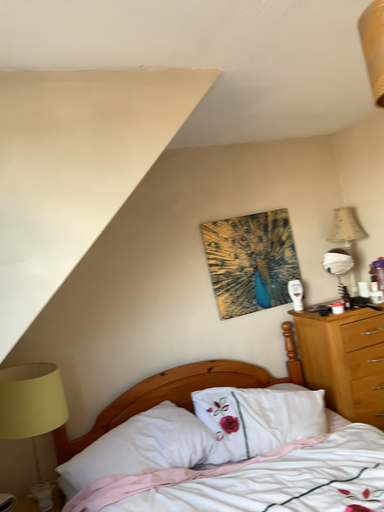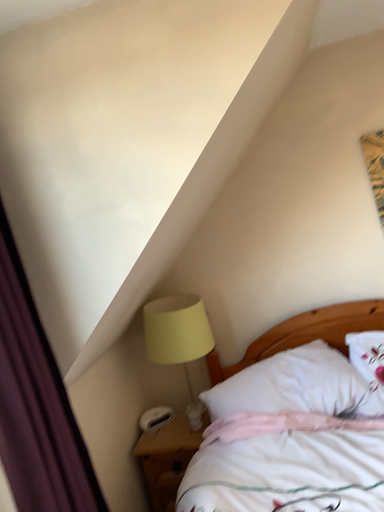
Question: How did the camera likely rotate when shooting the video?

Choices:
 (A) rotated downward
 (B) rotated upward

Answer: (A)